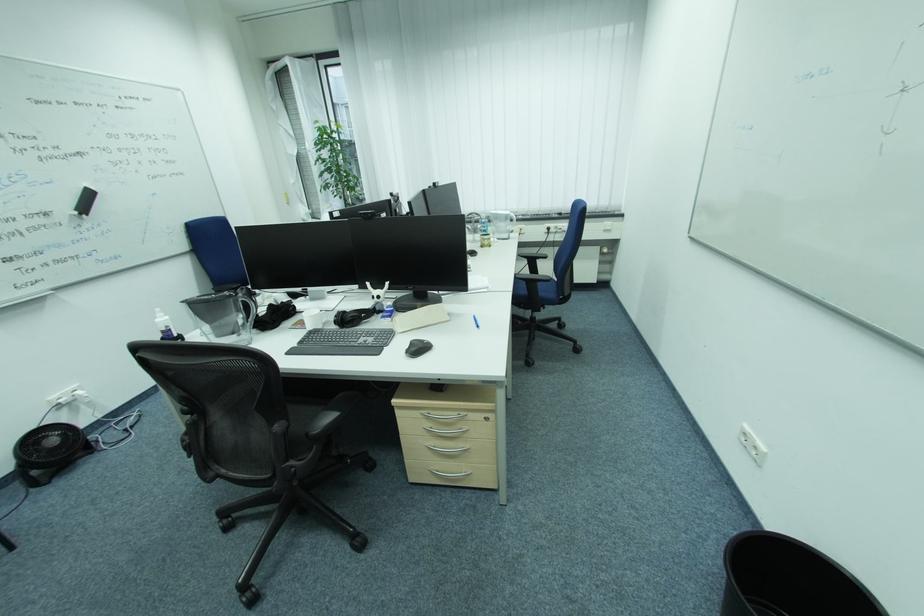
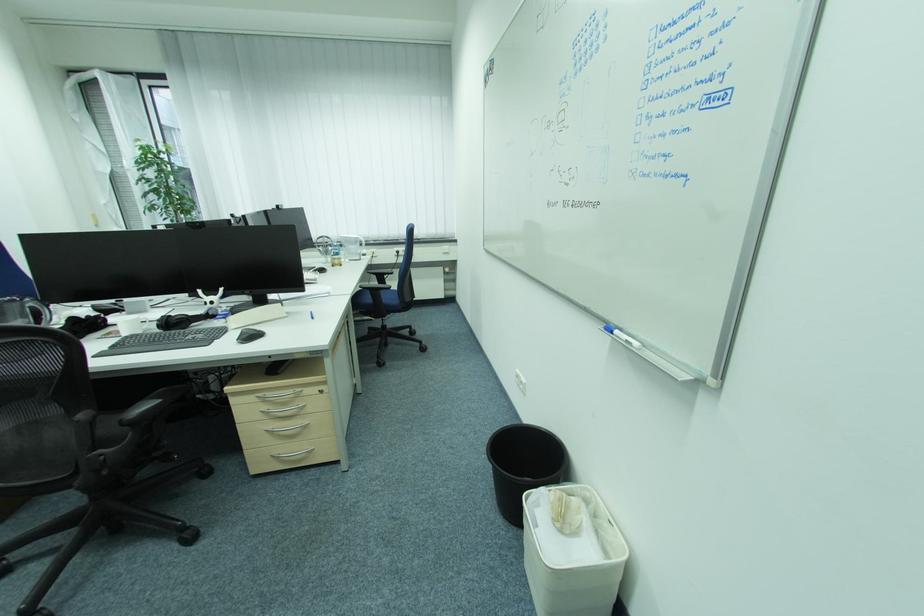
In the second image, find the point that corresponds to point (313, 435) in the first image.

(128, 422)